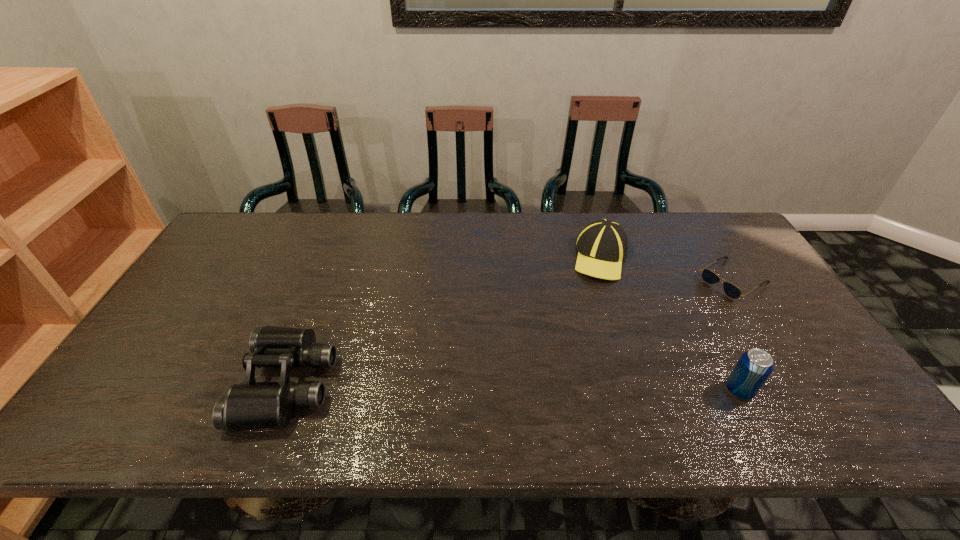
Where is `vacant space located 0.160m on the front-facing side of the sunglasses`? vacant space located 0.160m on the front-facing side of the sunglasses is located at coordinates coord(678,315).

I want to click on vacant space located on the front-facing side of the sunglasses, so click(619, 353).

Locate an element on the screen. The height and width of the screenshot is (540, 960). blank space located with the brim of the baseball cap facing forward is located at coordinates pyautogui.click(x=585, y=294).

Locate an element on the screen. This screenshot has height=540, width=960. vacant space situated 0.200m with the brim of the baseball cap facing forward is located at coordinates (568, 323).

The height and width of the screenshot is (540, 960). Identify the location of free spot located 0.310m with the brim of the baseball cap facing forward. (553, 351).

Where is `object that is positioned at the far edge`? object that is positioned at the far edge is located at coordinates (602, 245).

The height and width of the screenshot is (540, 960). I want to click on binoculars positioned at the near edge, so click(250, 405).

The height and width of the screenshot is (540, 960). I want to click on beer can positioned at the near edge, so tap(753, 368).

At what (x,y) coordinates should I click in order to perform the action: click on object that is at the right edge. Please return your answer as a coordinate pair (x, y). Image resolution: width=960 pixels, height=540 pixels. Looking at the image, I should click on (732, 291).

Where is `vacant region at the far edge`? The width and height of the screenshot is (960, 540). vacant region at the far edge is located at coordinates (563, 218).